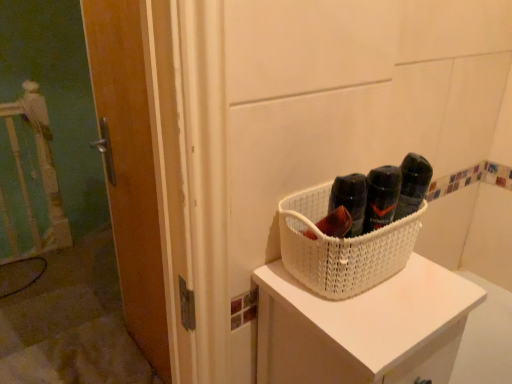
Question: Is white woven basket at upper right thinner than wooden door at left?

Choices:
 (A) yes
 (B) no

Answer: (B)

Question: Could you tell me if white woven basket at upper right is facing wooden door at left?

Choices:
 (A) yes
 (B) no

Answer: (B)

Question: From a real-world perspective, is white woven basket at upper right located beneath wooden door at left?

Choices:
 (A) yes
 (B) no

Answer: (B)

Question: From the image's perspective, is white woven basket at upper right below wooden door at left?

Choices:
 (A) no
 (B) yes

Answer: (B)

Question: Is white woven basket at upper right with wooden door at left?

Choices:
 (A) no
 (B) yes

Answer: (A)

Question: Is white woven basket at upper right at the right side of wooden door at left?

Choices:
 (A) no
 (B) yes

Answer: (B)

Question: Can you confirm if white woven basket at center is positioned to the left of wooden door at left?

Choices:
 (A) no
 (B) yes

Answer: (A)

Question: From a real-world perspective, does white woven basket at center stand above wooden door at left?

Choices:
 (A) yes
 (B) no

Answer: (A)

Question: Would you say white woven basket at center contains wooden door at left?

Choices:
 (A) yes
 (B) no

Answer: (B)

Question: From the image's perspective, is white woven basket at center on wooden door at left?

Choices:
 (A) no
 (B) yes

Answer: (B)

Question: Is white woven basket at center at the right side of wooden door at left?

Choices:
 (A) yes
 (B) no

Answer: (A)

Question: Does white woven basket at center come in front of wooden door at left?

Choices:
 (A) no
 (B) yes

Answer: (B)

Question: From the image's perspective, would you say wooden door at left is shown under white woven basket at center?

Choices:
 (A) no
 (B) yes

Answer: (B)